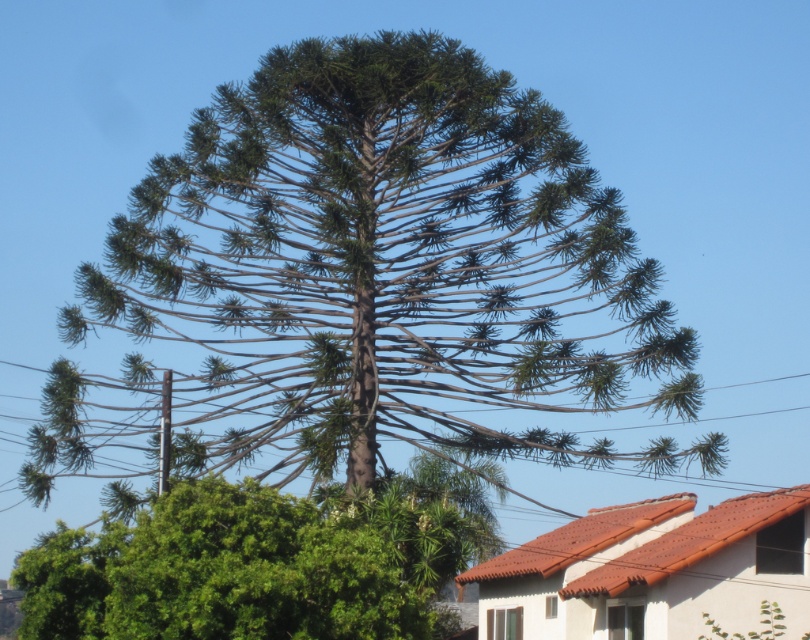
Is green textured tree at center below metallic wire at center?

Actually, green textured tree at center is above metallic wire at center.

Measure the distance between green textured tree at center and camera.

56.39 meters

This screenshot has width=810, height=640. I want to click on green textured tree at center, so click(371, 280).

Measure the distance from metallic wire at center to green leafy tree at lower left.

metallic wire at center is 29.64 meters away from green leafy tree at lower left.

Describe the element at coordinates (420, 403) in the screenshot. I see `metallic wire at center` at that location.

Which is behind, point (39, 474) or point (105, 589)?

Positioned behind is point (39, 474).

At what (x,y) coordinates should I click in order to perform the action: click on metallic wire at center. Please return your answer as a coordinate pair (x, y). The height and width of the screenshot is (640, 810). Looking at the image, I should click on [x=420, y=403].

How far apart are green textured tree at center and green leafy tree at lower left?

They are 85.30 feet apart.

Does green textured tree at center have a larger size compared to green leafy tree at lower left?

Indeed, green textured tree at center has a larger size compared to green leafy tree at lower left.

Locate an element on the screen. Image resolution: width=810 pixels, height=640 pixels. green textured tree at center is located at coordinates (371, 280).

What are the coordinates of `green textured tree at center` in the screenshot? It's located at (371, 280).